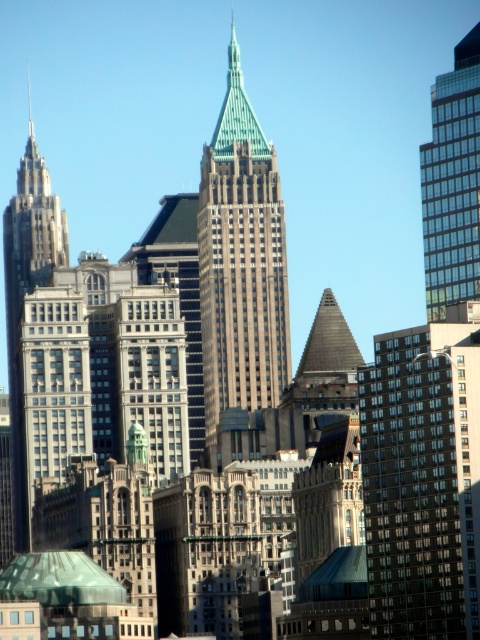
Question: Is green-tipped skyscraper at center behind glassy reflective skyscraper at right?

Choices:
 (A) no
 (B) yes

Answer: (B)

Question: Observing the image, what is the correct spatial positioning of green-tipped skyscraper at center in reference to glassy reflective skyscraper at right?

Choices:
 (A) left
 (B) right

Answer: (A)

Question: Is green-tipped skyscraper at center thinner than glassy reflective skyscraper at right?

Choices:
 (A) yes
 (B) no

Answer: (B)